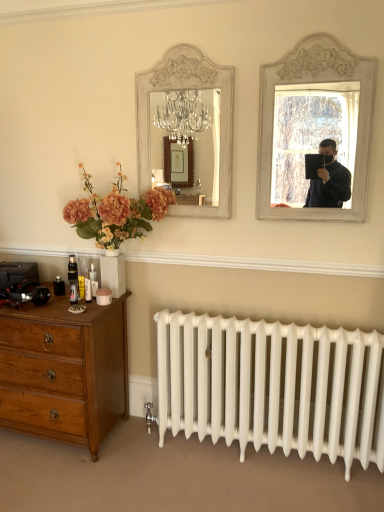
Question: Is the depth of white painted wood mirror at upper center less than that of wooden dresser at lower left?

Choices:
 (A) no
 (B) yes

Answer: (A)

Question: Considering the relative sizes of white painted wood mirror at upper center and wooden dresser at lower left in the image provided, is white painted wood mirror at upper center wider than wooden dresser at lower left?

Choices:
 (A) yes
 (B) no

Answer: (B)

Question: Is wooden dresser at lower left completely or partially inside white painted wood mirror at upper center?

Choices:
 (A) no
 (B) yes

Answer: (A)

Question: Are white painted wood mirror at upper center and wooden dresser at lower left located far from each other?

Choices:
 (A) no
 (B) yes

Answer: (B)

Question: Is white painted wood mirror at upper center bigger than wooden dresser at lower left?

Choices:
 (A) yes
 (B) no

Answer: (B)

Question: Considering the positions of white painted wood mirror at upper right and wooden dresser at lower left in the image, is white painted wood mirror at upper right wider or thinner than wooden dresser at lower left?

Choices:
 (A) wide
 (B) thin

Answer: (B)

Question: Considering their positions, is white painted wood mirror at upper right located in front of or behind wooden dresser at lower left?

Choices:
 (A) behind
 (B) front

Answer: (B)

Question: From the image's perspective, relative to wooden dresser at lower left, is white painted wood mirror at upper right above or below?

Choices:
 (A) below
 (B) above

Answer: (B)

Question: From a real-world perspective, is white painted wood mirror at upper right physically located above or below wooden dresser at lower left?

Choices:
 (A) below
 (B) above

Answer: (B)

Question: In terms of height, does white painted wood mirror at upper center look taller or shorter compared to wooden dresser at lower left?

Choices:
 (A) short
 (B) tall

Answer: (B)

Question: Choose the correct answer: Is white painted wood mirror at upper center inside wooden dresser at lower left or outside it?

Choices:
 (A) outside
 (B) inside

Answer: (A)

Question: Is white painted wood mirror at upper center wider or thinner than wooden dresser at lower left?

Choices:
 (A) thin
 (B) wide

Answer: (A)

Question: Visually, is white painted wood mirror at upper center positioned to the left or to the right of wooden dresser at lower left?

Choices:
 (A) left
 (B) right

Answer: (B)

Question: Looking at the image, does white painted wood mirror at upper right seem bigger or smaller compared to white painted wood mirror at upper center?

Choices:
 (A) big
 (B) small

Answer: (A)

Question: Considering the positions of white painted wood mirror at upper right and white painted wood mirror at upper center in the image, is white painted wood mirror at upper right taller or shorter than white painted wood mirror at upper center?

Choices:
 (A) short
 (B) tall

Answer: (B)